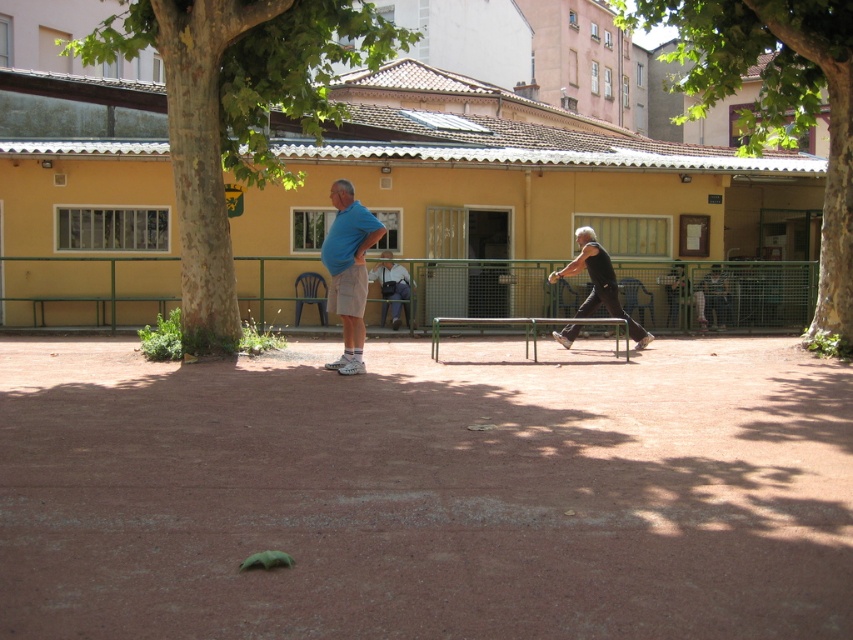
You are standing at the point with coordinates point [386,256] and want to walk to the point with coordinates point [670,308]. According to the scene, will you be moving towards the background or the foreground?

Since point [670,308] is behind point [386,256], moving from point [386,256] to point [670,308] means you are moving towards the background.

Based on the photo, you are standing at the point labeled point (636, 326) and want to walk towards the yellow building with a tiled roof in the background. Which direction should you move relative to the point labeled point (688, 280)?

Since point (636, 326) is closer to the camera than point (688, 280), you should move away from point (688, 280) towards the yellow building in the background.